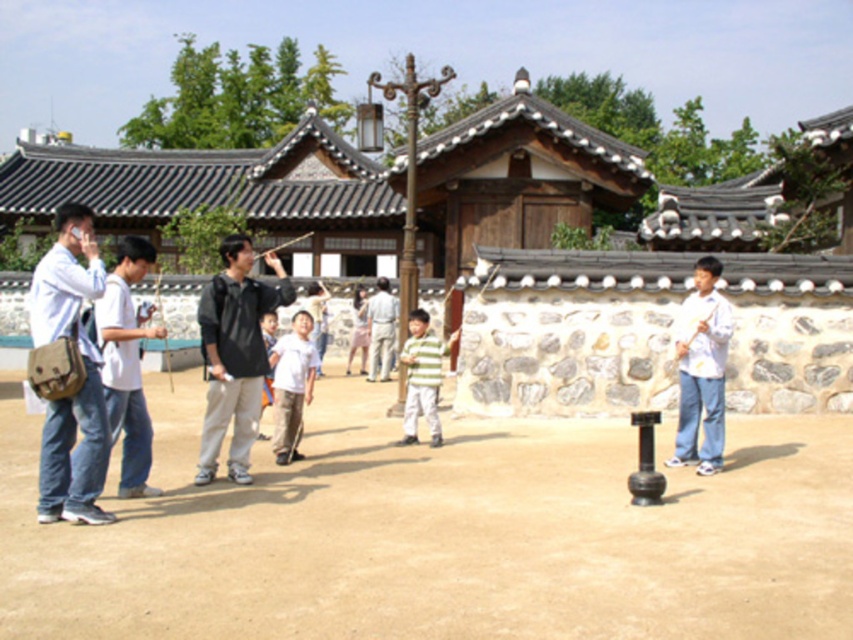
Question: Which of the following is the farthest from the observer?

Choices:
 (A) pink fabric dress at center
 (B) light gray fabric shirt at center

Answer: (A)

Question: Which point is farther to the camera?

Choices:
 (A) white cotton shirt at center
 (B) striped cotton shirt at center
 (C) light gray fabric shirt at center

Answer: (C)

Question: Which of the following is the closest to the observer?

Choices:
 (A) (357, 342)
 (B) (132, 397)

Answer: (B)

Question: Is denim jacket at left closer to camera compared to white cotton shirt at center?

Choices:
 (A) no
 (B) yes

Answer: (B)

Question: Is light gray fabric shirt at center above pink fabric dress at center?

Choices:
 (A) yes
 (B) no

Answer: (A)

Question: Can you confirm if white cotton shirt at right is positioned below white cotton shirt at center?

Choices:
 (A) yes
 (B) no

Answer: (B)